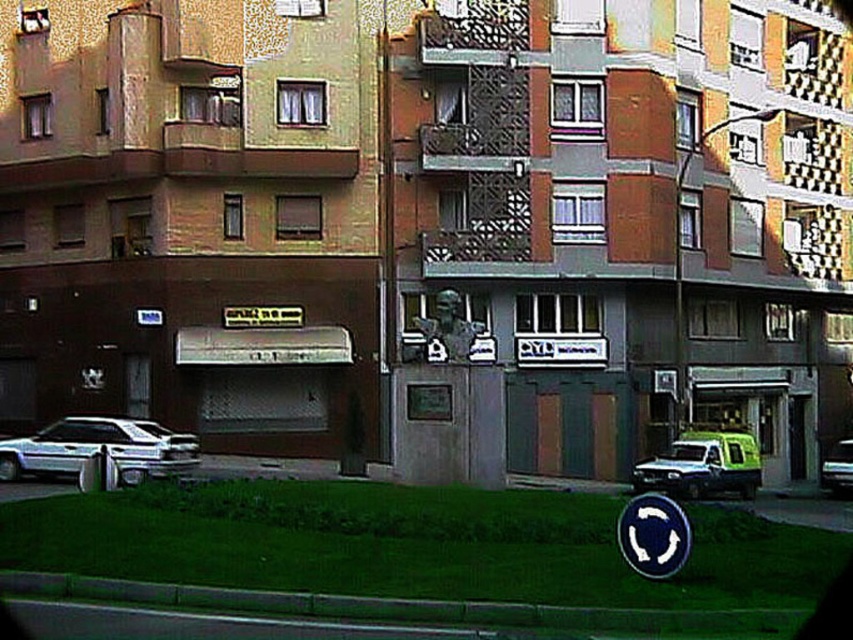
Question: Which point is farther to the camera?

Choices:
 (A) (843, 461)
 (B) (178, 472)
 (C) (682, 442)

Answer: (A)

Question: Can you confirm if white glossy car at lower left is wider than blue metallic circle at center?

Choices:
 (A) no
 (B) yes

Answer: (B)

Question: Among these objects, which one is farthest from the camera?

Choices:
 (A) shiny silver van at right
 (B) green matte van at lower right
 (C) white glossy car at lower left
 (D) blue metallic circle at center

Answer: (A)

Question: Considering the relative positions of green matte van at lower right and shiny silver van at right in the image provided, where is green matte van at lower right located with respect to shiny silver van at right?

Choices:
 (A) left
 (B) right

Answer: (A)

Question: Can you confirm if blue metallic circle at center is positioned below shiny silver van at right?

Choices:
 (A) yes
 (B) no

Answer: (B)

Question: Which point is farther from the camera taking this photo?

Choices:
 (A) (840, 451)
 (B) (67, 433)

Answer: (A)